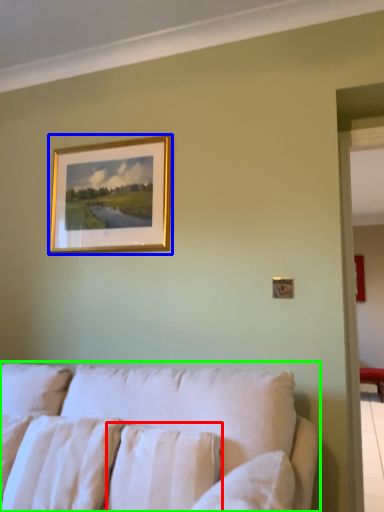
Question: Which is nearer to the pillow (highlighted by a red box)? picture frame (highlighted by a blue box) or studio couch (highlighted by a green box).

Choices:
 (A) picture frame
 (B) studio couch

Answer: (B)